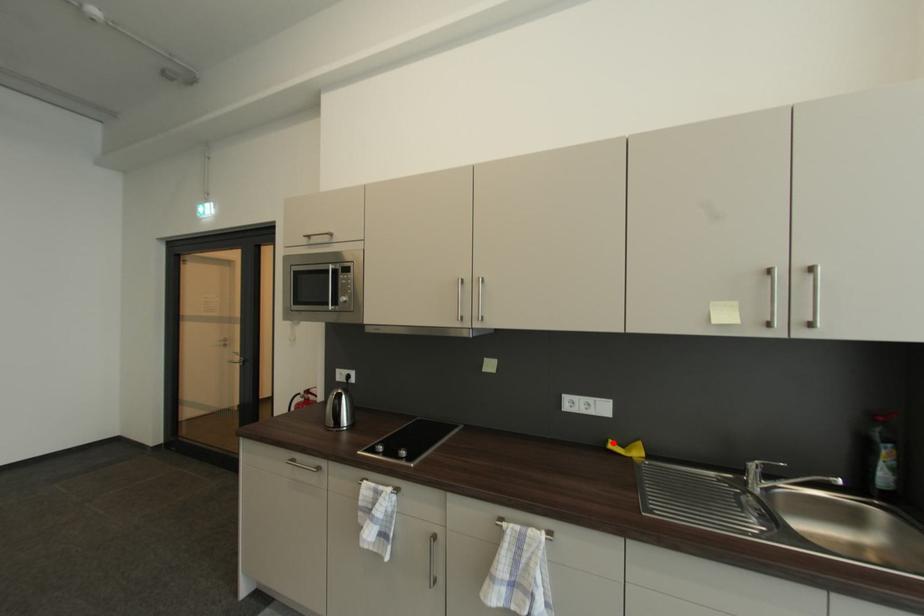
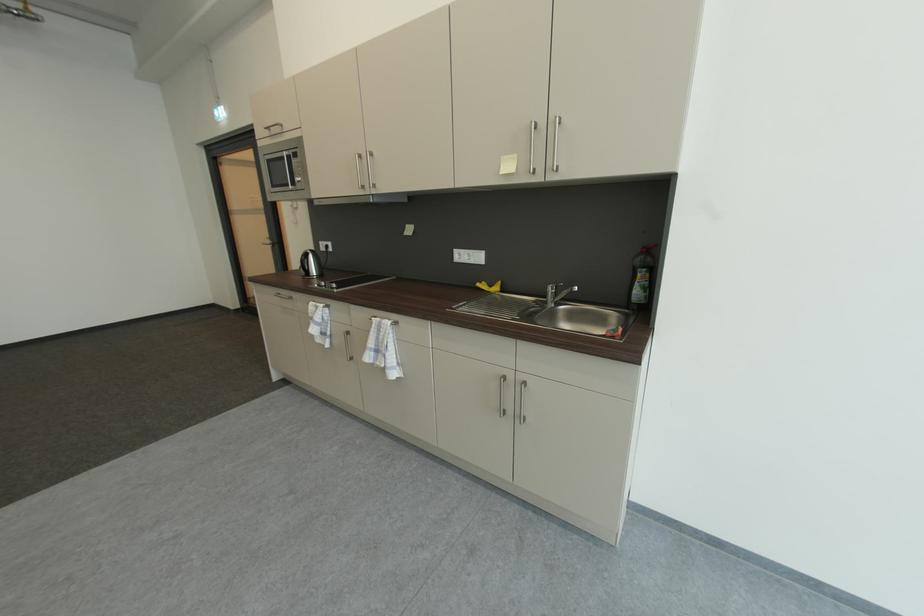
The point at the highlighted location is marked in the first image. Where is the corresponding point in the second image?

(487, 284)